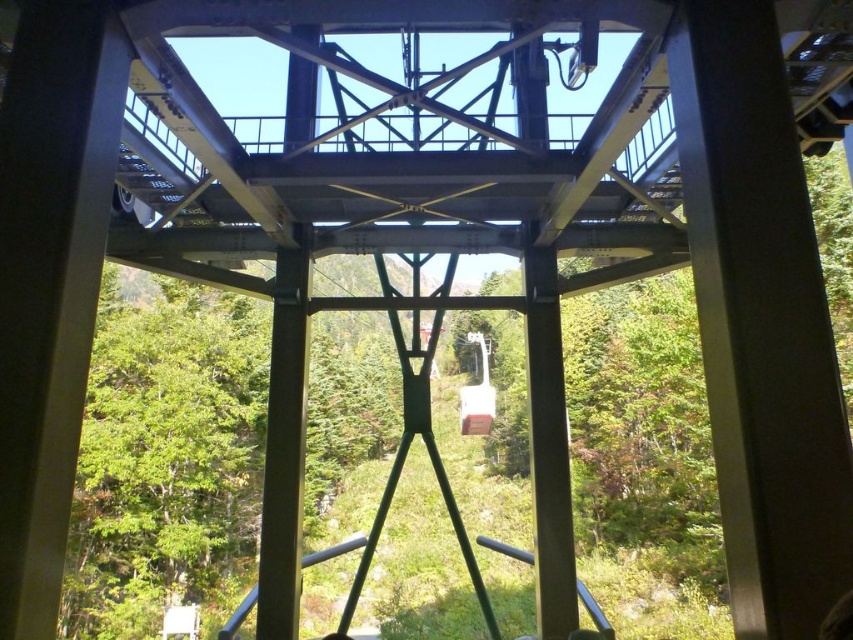
Question: Is green matte tree at center closer to camera compared to metallic cable car at center?

Choices:
 (A) no
 (B) yes

Answer: (B)

Question: Which object appears closest to the camera in this image?

Choices:
 (A) green matte tree at center
 (B) metallic cable car at center

Answer: (A)

Question: Can you confirm if green matte tree at center is smaller than metallic cable car at center?

Choices:
 (A) no
 (B) yes

Answer: (A)

Question: Among these points, which one is nearest to the camera?

Choices:
 (A) (105, 307)
 (B) (469, 406)

Answer: (A)

Question: Is green matte tree at center above metallic cable car at center?

Choices:
 (A) no
 (B) yes

Answer: (B)

Question: Which of the following is the closest to the observer?

Choices:
 (A) metallic cable car at center
 (B) green matte tree at center

Answer: (B)